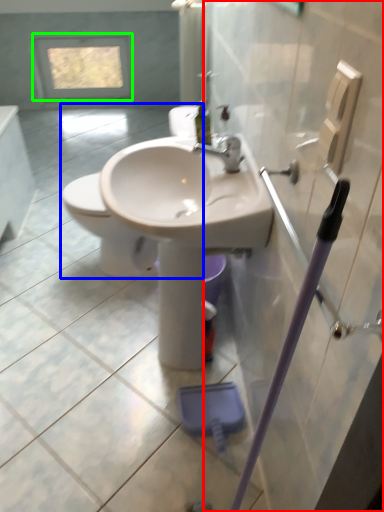
Question: Which is farther away from screen door (highlighted by a red box)? toilet (highlighted by a blue box) or window (highlighted by a green box)?

Choices:
 (A) toilet
 (B) window

Answer: (B)